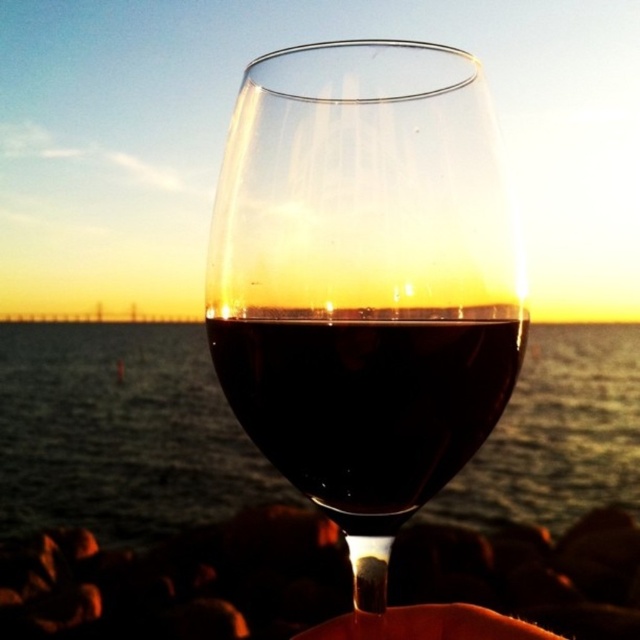
You are an artist trying to paint the sunset scene. You notice the shiny dark red wine at center and the matte skin hand at center in the image. Which object appears taller in the painting?

The shiny dark red wine at center appears taller than the matte skin hand at center in the painting.

Looking at this image, you are standing in the scene and want to place a small decorative stone between the two points, point (392, 330) and point (403, 636). Which point should the stone be closer to in order to be placed in the foreground?

The stone should be closer to point (392, 330) because it is in front of point (403, 636).

You are a bartender trying to pour more wine into the transparent glass at center without spilling. Considering the position of the shiny dark red wine at center, how should you tilt the glass?

The transparent glass at center is located above the shiny dark red wine at center, so you should tilt the glass so that the shiny dark red wine at center moves away from the rim to prevent spilling.